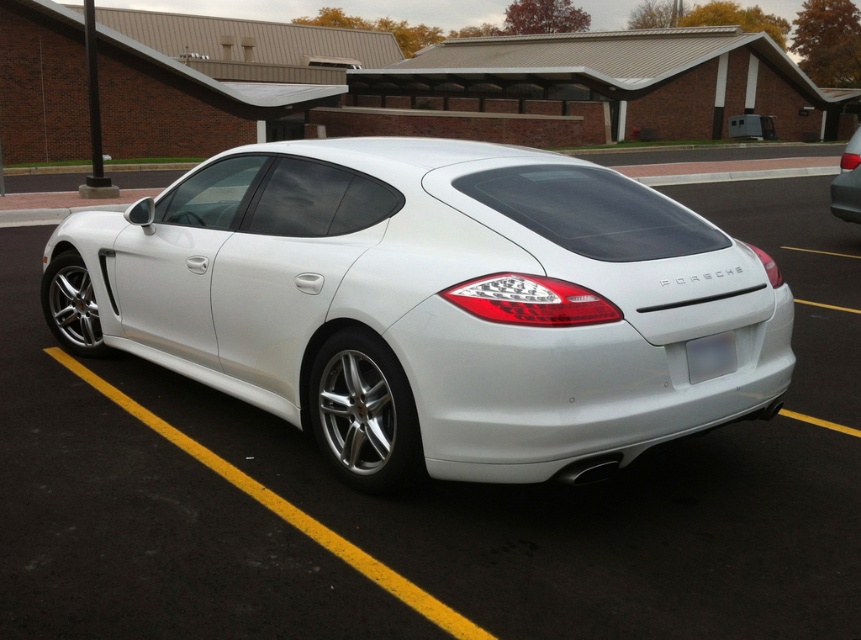
Which is in front, point (704, 337) or point (838, 196)?

Positioned in front is point (704, 337).

This screenshot has width=861, height=640. Find the location of `white plastic license plate at rear`. white plastic license plate at rear is located at coordinates (710, 356).

At what (x,y) coordinates should I click in order to perform the action: click on white plastic license plate at rear. Please return your answer as a coordinate pair (x, y). The height and width of the screenshot is (640, 861). Looking at the image, I should click on (710, 356).

How distant is white metallic car at center from white glossy car at right?

white metallic car at center is 31.30 feet away from white glossy car at right.

Consider the image. Is white metallic car at center wider than white glossy car at right?

In fact, white metallic car at center might be narrower than white glossy car at right.

Does point (661, 336) lie in front of point (829, 188)?

Yes, point (661, 336) is in front of point (829, 188).

This screenshot has height=640, width=861. What are the coordinates of `white metallic car at center` in the screenshot? It's located at click(430, 305).

Does white metallic car at center have a larger size compared to white plastic license plate at rear?

Yes.

Is white metallic car at center wider than white plastic license plate at rear?

Correct, the width of white metallic car at center exceeds that of white plastic license plate at rear.

Who is more distant from viewer, [135,257] or [686,346]?

The point [135,257] is behind.

The height and width of the screenshot is (640, 861). In order to click on white metallic car at center in this screenshot , I will do `click(430, 305)`.